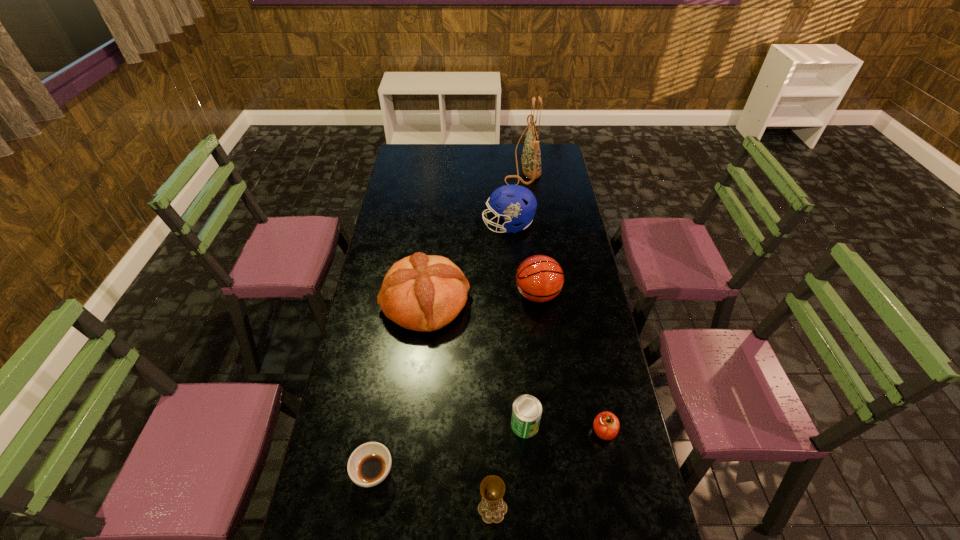
You are a GUI agent. You are given a task and a screenshot of the screen. Output one action in this format:
    pyautogui.click(x=<x>, y=<y>)
    Task: Click on the free point located 0.340m on the back of the sixth tallest object
    Image resolution: width=960 pixels, height=540 pixels.
    Given the screenshot: What is the action you would take?
    pyautogui.click(x=517, y=326)

Identify the location of free location located on the left of the rightmost object. (506, 431).

Image resolution: width=960 pixels, height=540 pixels. I want to click on vacant space located 0.330m on the right of the soup bowl, so click(x=511, y=473).

Find the location of a particular element. Image resolution: width=960 pixels, height=540 pixels. object that is at the far edge is located at coordinates (531, 156).

Find the location of a particular element. bread that is positioned at the left edge is located at coordinates [421, 292].

Image resolution: width=960 pixels, height=540 pixels. Identify the location of soup bowl present at the left edge. (370, 463).

The image size is (960, 540). Identify the location of handbag present at the right edge. [x=531, y=156].

This screenshot has height=540, width=960. Find the location of `basketball present at the right edge`. basketball present at the right edge is located at coordinates (539, 278).

Locate an element on the screen. This screenshot has width=960, height=540. apple located at the right edge is located at coordinates (606, 425).

I want to click on object that is at the far right corner, so click(x=531, y=156).